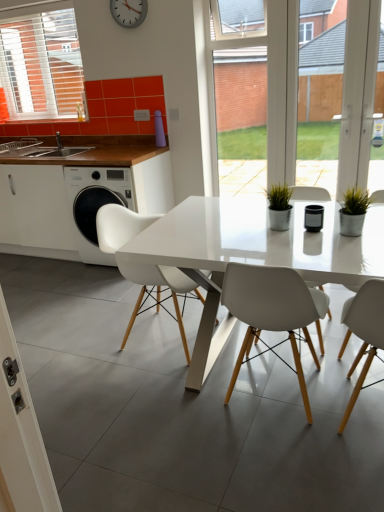
Question: From the image's perspective, relative to white plastic chair at center, acting as the first chair starting from the left, is transparent glass door at center above or below?

Choices:
 (A) below
 (B) above

Answer: (B)

Question: Is transparent glass door at center spatially inside white plastic chair at center, which is the second chair in right-to-left order, or outside of it?

Choices:
 (A) outside
 (B) inside

Answer: (A)

Question: Which is nearer to the brown wood countertop at left?

Choices:
 (A) transparent glass door at center
 (B) white matte cabinet at left
 (C) silver metallic clock at upper center
 (D) white matte chair at center, positioned as the 1th chair in right-to-left order
 (E) white glossy table at center

Answer: (B)

Question: Which object is the farthest from the brown wood countertop at left?

Choices:
 (A) white matte chair at center, positioned as the 1th chair in right-to-left order
 (B) white glossy table at center
 (C) transparent glass door at center
 (D) silver metallic clock at upper center
 (E) white matte cabinet at left

Answer: (C)